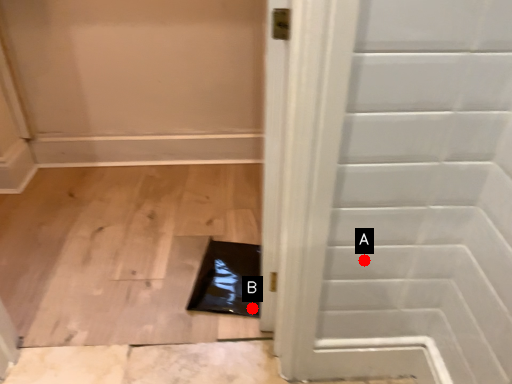
Question: Two points are circled on the image, labeled by A and B beside each circle. Which point is closer to the camera?

Choices:
 (A) A is closer
 (B) B is closer

Answer: (A)